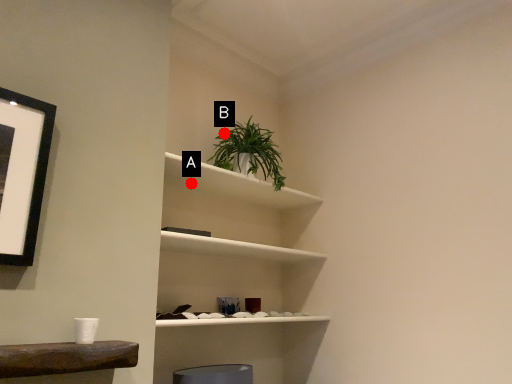
Question: Two points are circled on the image, labeled by A and B beside each circle. Among these points, which one is nearest to the camera?

Choices:
 (A) A is closer
 (B) B is closer

Answer: (A)